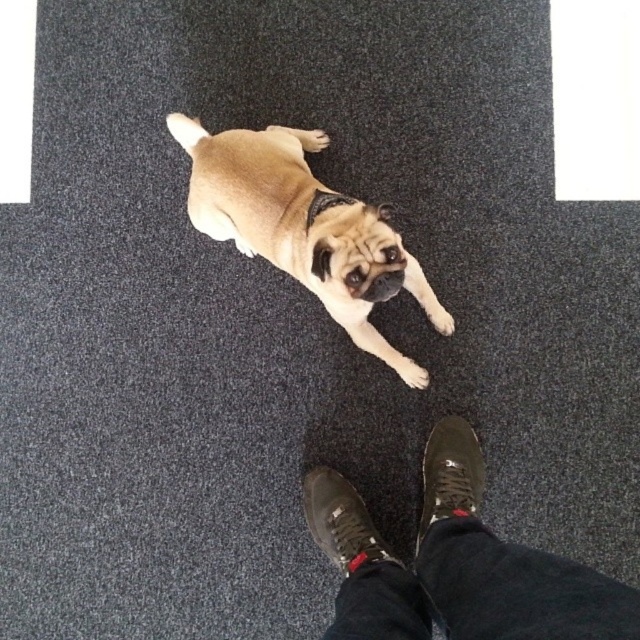
Which of these two, black leather shoes at center or furry beige dog at center, stands taller?

With more height is furry beige dog at center.

Where is `black leather shoes at center`? black leather shoes at center is located at coordinates (456, 564).

Who is more forward, (572, 625) or (394, 292)?

Point (572, 625)

Image resolution: width=640 pixels, height=640 pixels. What are the coordinates of `black leather shoes at center` in the screenshot? It's located at (456, 564).

Does point (232, 160) come farther from viewer compared to point (413, 385)?

That is False.

Can you confirm if furry beige dog at center is shorter than light brown fur paw at center?

No.

This screenshot has width=640, height=640. Find the location of `furry beige dog at center`. furry beige dog at center is located at coordinates (298, 221).

Is black leather shoes at center behind light brown fur paw at center?

No, it is not.

Does black leather shoes at center have a smaller size compared to light brown fur paw at center?

Actually, black leather shoes at center might be larger than light brown fur paw at center.

Who is more distant from viewer, (460,538) or (396,369)?

The point (396,369) is behind.

The image size is (640, 640). I want to click on black leather shoes at center, so click(x=456, y=564).